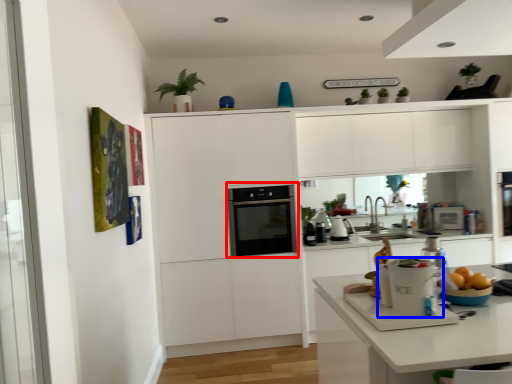
Question: Which point is closer to the camera, home appliance (highlighted by a red box) or kitchen appliance (highlighted by a blue box)?

Choices:
 (A) home appliance
 (B) kitchen appliance

Answer: (B)